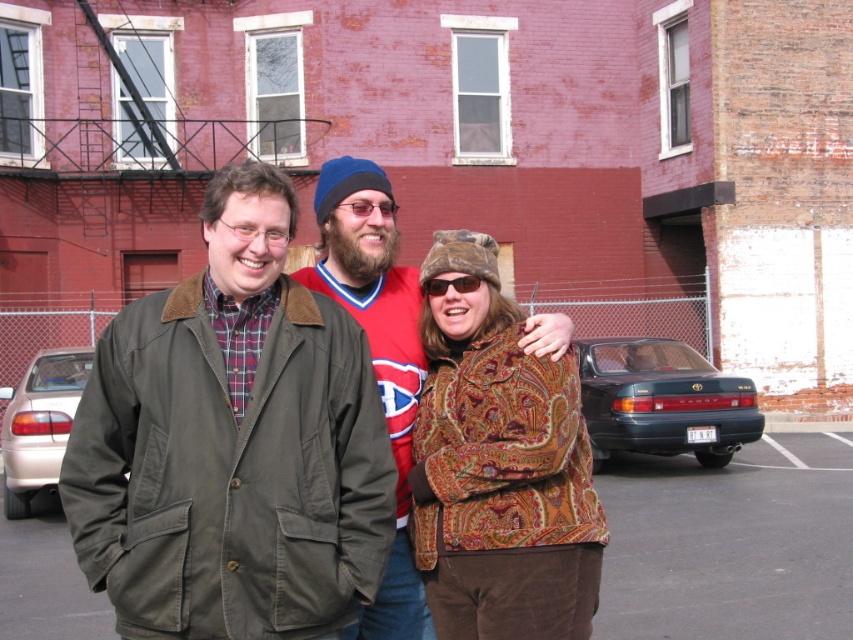
Can you confirm if gold metallic car at lower left is positioned below black plastic sunglasses at center?

Yes, gold metallic car at lower left is below black plastic sunglasses at center.

Can you confirm if gold metallic car at lower left is bigger than black plastic sunglasses at center?

Correct, gold metallic car at lower left is larger in size than black plastic sunglasses at center.

Find the location of a particular element. gold metallic car at lower left is located at coordinates (39, 422).

Measure the distance between point (x=260, y=216) and camera.

Point (x=260, y=216) and camera are 2.48 meters apart from each other.

Locate an element on the screen. brown textured coat at center is located at coordinates click(x=233, y=444).

Find the location of a particular element. brown textured coat at center is located at coordinates (233, 444).

This screenshot has width=853, height=640. In order to click on brown textured coat at center in this screenshot , I will do point(233,444).

Is paisley-patterned jacket at center bigger than dark gray asphalt at lower center?

No, paisley-patterned jacket at center is not bigger than dark gray asphalt at lower center.

From the picture: Between paisley-patterned jacket at center and dark gray asphalt at lower center, which one is positioned higher?

paisley-patterned jacket at center

Which is behind, point (440, 429) or point (613, 492)?

The point (613, 492) is behind.

Where is `paisley-patterned jacket at center`? The height and width of the screenshot is (640, 853). paisley-patterned jacket at center is located at coordinates (498, 467).